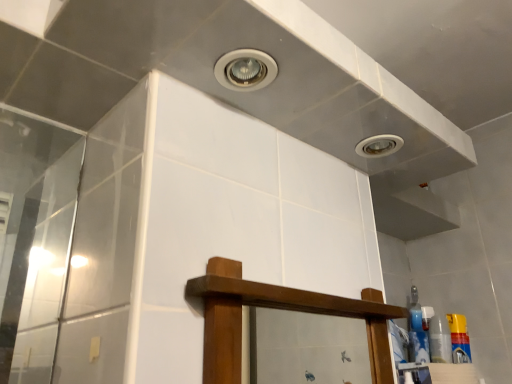
Question: Is yellow plastic spray can at right located outside matte white droplight at upper right?

Choices:
 (A) yes
 (B) no

Answer: (A)

Question: From a real-world perspective, is yellow plastic spray can at right over matte white droplight at upper right?

Choices:
 (A) yes
 (B) no

Answer: (B)

Question: Does yellow plastic spray can at right have a greater height compared to matte white droplight at upper right?

Choices:
 (A) yes
 (B) no

Answer: (A)

Question: Can you confirm if yellow plastic spray can at right is wider than matte white droplight at upper right?

Choices:
 (A) yes
 (B) no

Answer: (B)

Question: Does yellow plastic spray can at right have a lesser width compared to matte white droplight at upper right?

Choices:
 (A) no
 (B) yes

Answer: (B)

Question: Can you confirm if yellow plastic spray can at right is shorter than matte white droplight at upper right?

Choices:
 (A) no
 (B) yes

Answer: (A)

Question: From the image's perspective, is matte white droplight at upper right below yellow plastic spray can at right?

Choices:
 (A) yes
 (B) no

Answer: (B)

Question: From the image's perspective, is matte white droplight at upper right over yellow plastic spray can at right?

Choices:
 (A) yes
 (B) no

Answer: (A)

Question: Is matte white droplight at upper right at the right side of yellow plastic spray can at right?

Choices:
 (A) no
 (B) yes

Answer: (A)

Question: Is matte white droplight at upper right bigger than yellow plastic spray can at right?

Choices:
 (A) yes
 (B) no

Answer: (B)

Question: Would you say yellow plastic spray can at right is part of matte white droplight at upper right's contents?

Choices:
 (A) yes
 (B) no

Answer: (B)

Question: Is matte white droplight at upper right wider than yellow plastic spray can at right?

Choices:
 (A) no
 (B) yes

Answer: (B)

Question: From a real-world perspective, relative to matte white droplight at upper right, is yellow plastic spray can at right vertically above or below?

Choices:
 (A) above
 (B) below

Answer: (B)